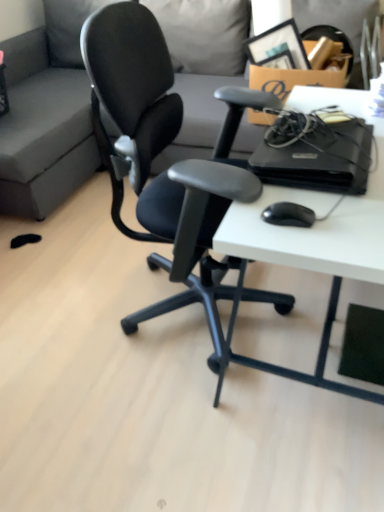
Question: Does white matte desk at center lie in front of black plastic computer at right?

Choices:
 (A) no
 (B) yes

Answer: (B)

Question: Is white matte desk at center beside black plastic computer at right?

Choices:
 (A) no
 (B) yes

Answer: (A)

Question: Does white matte desk at center appear on the left side of black plastic computer at right?

Choices:
 (A) no
 (B) yes

Answer: (A)

Question: From the image's perspective, would you say white matte desk at center is shown under black plastic computer at right?

Choices:
 (A) yes
 (B) no

Answer: (A)

Question: Considering the relative sizes of white matte desk at center and black plastic computer at right in the image provided, is white matte desk at center taller than black plastic computer at right?

Choices:
 (A) yes
 (B) no

Answer: (A)

Question: From a real-world perspective, is black matte mouse at lower right physically located above or below cardboard box at upper right?

Choices:
 (A) above
 (B) below

Answer: (A)

Question: Considering the positions of black matte mouse at lower right and cardboard box at upper right in the image, is black matte mouse at lower right taller or shorter than cardboard box at upper right?

Choices:
 (A) tall
 (B) short

Answer: (B)

Question: Relative to cardboard box at upper right, is black matte mouse at lower right in front or behind?

Choices:
 (A) front
 (B) behind

Answer: (A)

Question: Considering the relative positions of black matte mouse at lower right and cardboard box at upper right in the image provided, is black matte mouse at lower right to the left or to the right of cardboard box at upper right?

Choices:
 (A) right
 (B) left

Answer: (B)

Question: In terms of height, does black plastic computer at right look taller or shorter compared to cardboard box at upper right?

Choices:
 (A) tall
 (B) short

Answer: (B)

Question: Which is correct: black plastic computer at right is inside cardboard box at upper right, or outside of it?

Choices:
 (A) outside
 (B) inside

Answer: (A)

Question: Considering the relative positions of black plastic computer at right and cardboard box at upper right in the image provided, is black plastic computer at right to the left or to the right of cardboard box at upper right?

Choices:
 (A) right
 (B) left

Answer: (B)

Question: Is black plastic computer at right in front of or behind cardboard box at upper right in the image?

Choices:
 (A) behind
 (B) front

Answer: (B)

Question: Considering the positions of cardboard box at upper right and white matte desk at center in the image, is cardboard box at upper right wider or thinner than white matte desk at center?

Choices:
 (A) wide
 (B) thin

Answer: (B)

Question: Visually, is cardboard box at upper right positioned to the left or to the right of white matte desk at center?

Choices:
 (A) right
 (B) left

Answer: (A)